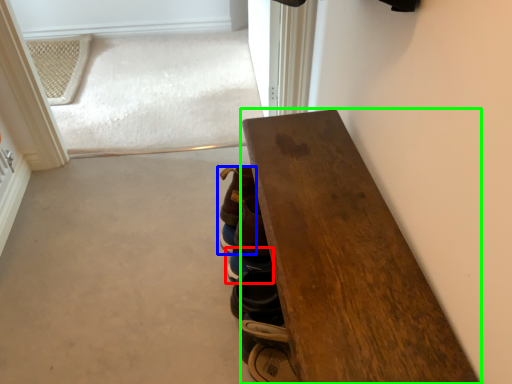
Question: Which is farther away from footwear (highlighted by a red box)? footwear (highlighted by a blue box) or table (highlighted by a green box)?

Choices:
 (A) footwear
 (B) table

Answer: (B)